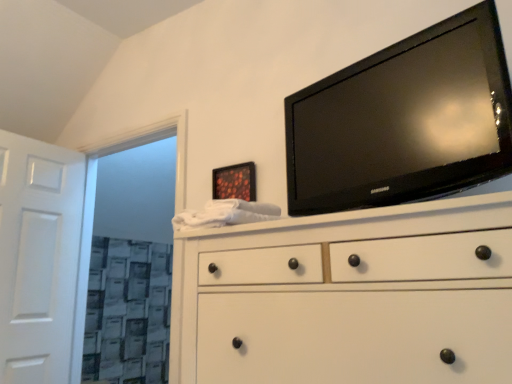
Question: Is black glossy tv at upper right bigger than white matte chest of drawers at center?

Choices:
 (A) yes
 (B) no

Answer: (B)

Question: Is black glossy tv at upper right oriented away from white matte chest of drawers at center?

Choices:
 (A) no
 (B) yes

Answer: (A)

Question: Is black glossy tv at upper right surrounding white matte chest of drawers at center?

Choices:
 (A) no
 (B) yes

Answer: (A)

Question: Are black glossy tv at upper right and white matte chest of drawers at center far apart?

Choices:
 (A) no
 (B) yes

Answer: (A)

Question: Can you confirm if black glossy tv at upper right is taller than white matte chest of drawers at center?

Choices:
 (A) no
 (B) yes

Answer: (A)

Question: Can you confirm if black glossy tv at upper right is smaller than white matte chest of drawers at center?

Choices:
 (A) yes
 (B) no

Answer: (A)

Question: Considering the relative sizes of white matte chest of drawers at center and white wooden door at left in the image provided, is white matte chest of drawers at center taller than white wooden door at left?

Choices:
 (A) no
 (B) yes

Answer: (A)

Question: Is white matte chest of drawers at center shorter than white wooden door at left?

Choices:
 (A) no
 (B) yes

Answer: (B)

Question: Is white matte chest of drawers at center smaller than white wooden door at left?

Choices:
 (A) no
 (B) yes

Answer: (A)

Question: Considering the relative sizes of white matte chest of drawers at center and white wooden door at left in the image provided, is white matte chest of drawers at center bigger than white wooden door at left?

Choices:
 (A) no
 (B) yes

Answer: (B)

Question: From a real-world perspective, is white matte chest of drawers at center physically above white wooden door at left?

Choices:
 (A) no
 (B) yes

Answer: (A)

Question: Considering the relative positions of white matte chest of drawers at center and white wooden door at left in the image provided, is white matte chest of drawers at center in front of white wooden door at left?

Choices:
 (A) yes
 (B) no

Answer: (A)

Question: Is there a large distance between white wooden door at left and white matte chest of drawers at center?

Choices:
 (A) no
 (B) yes

Answer: (B)